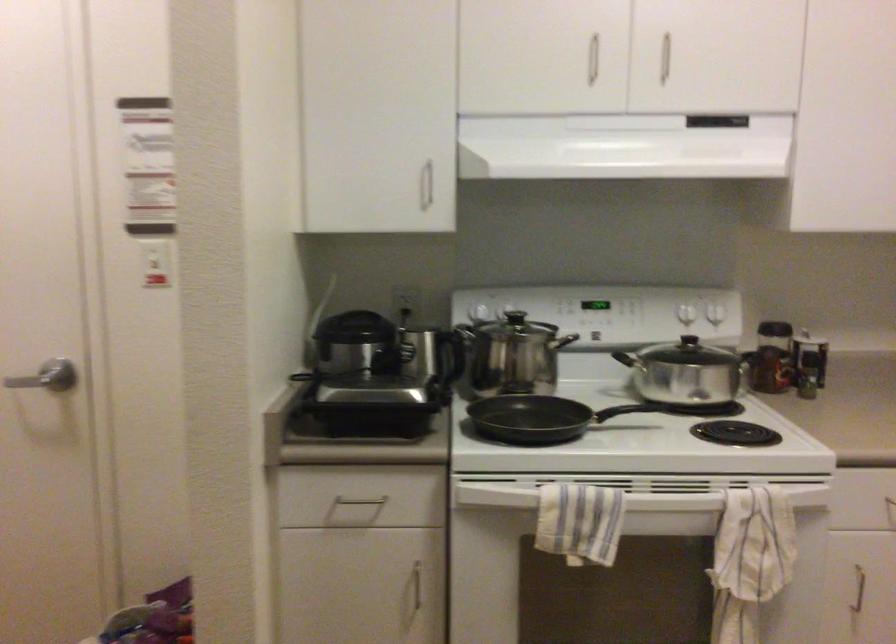
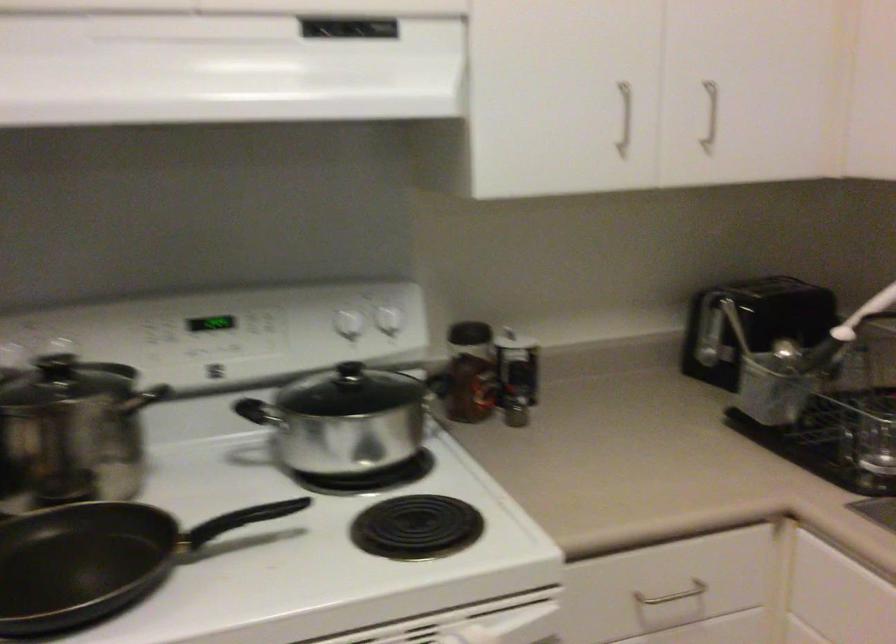
Which direction would the cameraman need to move to produce the second image?

The cameraman moved toward right, forward.